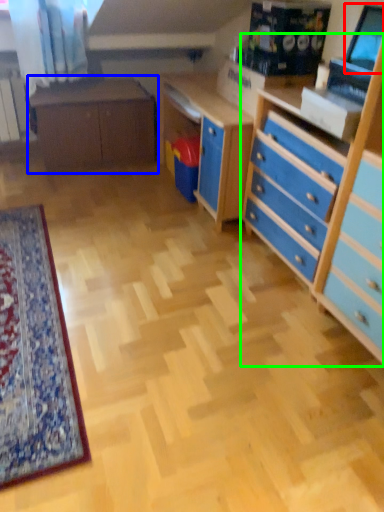
Question: Considering the real-world distances, which object is closest to computer monitor (highlighted by a red box)? table (highlighted by a blue box) or chest of drawers (highlighted by a green box).

Choices:
 (A) table
 (B) chest of drawers

Answer: (B)